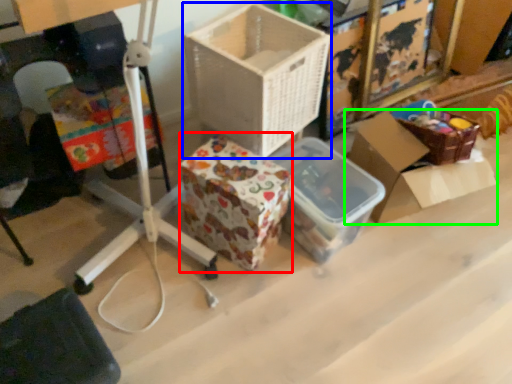
Question: Which object is the farthest from storage box (highlighted by a red box)? Choose among these: box (highlighted by a blue box) or box (highlighted by a green box).

Choices:
 (A) box
 (B) box

Answer: (B)